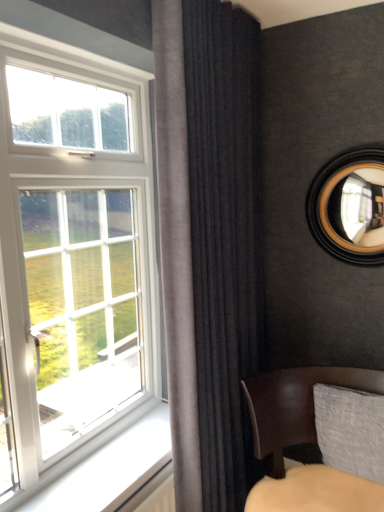
The height and width of the screenshot is (512, 384). I want to click on free space above wooden-framed mirror at upper right (from a real-world perspective), so click(346, 144).